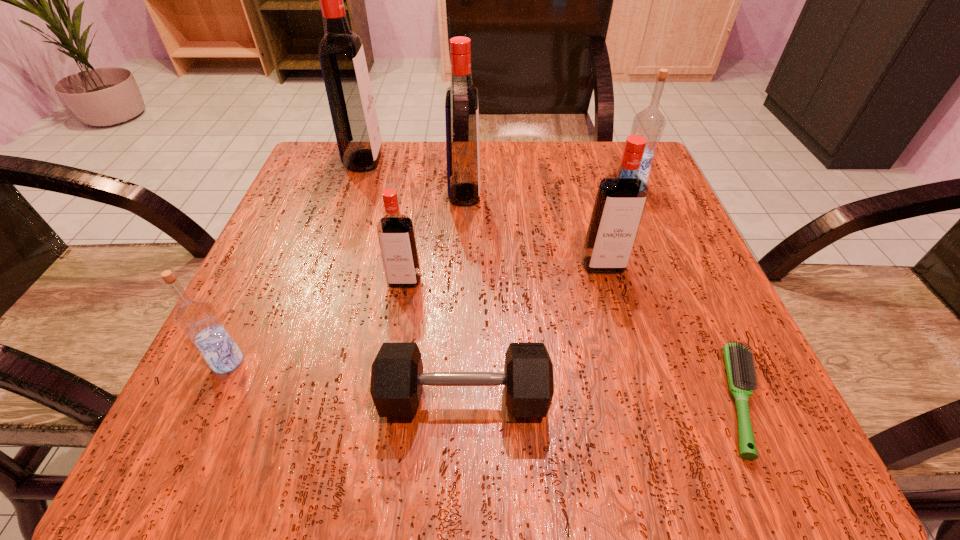
This screenshot has width=960, height=540. What are the coordinates of `vacant area that lies between the farther blue vodka and the nearer blue vodka` in the screenshot? It's located at (429, 273).

I want to click on free area in between the seventh tallest object and the bigger blue vodka, so tap(547, 292).

Locate an element on the screen. The image size is (960, 540). object identified as the sixth closest to the light hairbrush is located at coordinates (197, 318).

Locate an element on the screen. This screenshot has height=540, width=960. object that is the seventh closest one to the third biggest red vodka is located at coordinates (197, 318).

Find the location of a particular element. The height and width of the screenshot is (540, 960). vodka object that ranks as the fourth closest to the bigger blue vodka is located at coordinates [341, 54].

The image size is (960, 540). What are the coordinates of `the fifth closest vodka to the shortest object` in the screenshot? It's located at (197, 318).

At what (x,y) coordinates should I click in order to perform the action: click on red vodka object that ranks as the third closest to the second tallest vodka. Please return your answer as a coordinate pair (x, y). Looking at the image, I should click on (621, 197).

Choose which red vodka is the second nearest neighbor to the dumbbell. Please provide its 2D coordinates. Your answer should be formatted as a tuple, i.e. [(x, y)], where the tuple contains the x and y coordinates of a point satisfying the conditions above.

[(621, 197)]

Locate an element on the screen. vacant region that satisfies the following two spatial constraints: 1. on the front and back of the dumbbell; 2. on the right side of the third nearest red vodka is located at coordinates (456, 397).

Where is `vacant region that satisfies the following two spatial constraints: 1. on the front and back of the third vodka from right to left; 2. on the back side of the hairbrush`? This screenshot has width=960, height=540. vacant region that satisfies the following two spatial constraints: 1. on the front and back of the third vodka from right to left; 2. on the back side of the hairbrush is located at coordinates (456, 401).